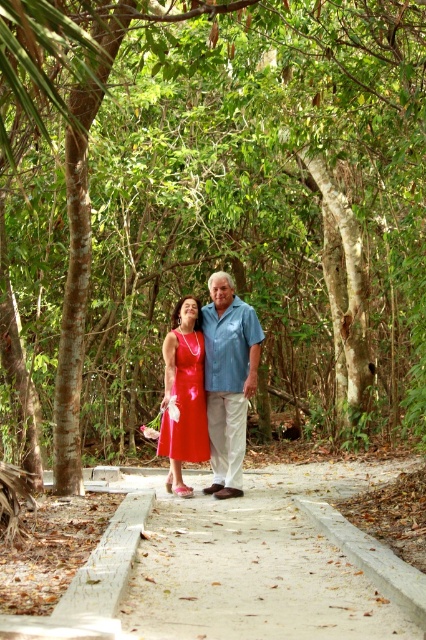
You are a photographer trying to capture a photo of both the matte blue shirt at center and the shiny satin dress at center. Which one should you focus on first if you want to include both in your frame without moving the camera?

The matte blue shirt at center is positioned on the right side of the shiny satin dress at center, so you should focus on the shiny satin dress at center first to ensure both are in frame.

You are a photographer trying to capture a closeup shot of both the matte blue shirt at center and the shiny satin dress at center. Given that your camera has a maximum focus range of 15 inches, will you be able to focus on both subjects simultaneously?

The matte blue shirt at center is 15.08 inches from the shiny satin dress at center. Since the distance between them is slightly more than the camera maximum focus range of 15 inches, you cannot focus on both subjects simultaneously.